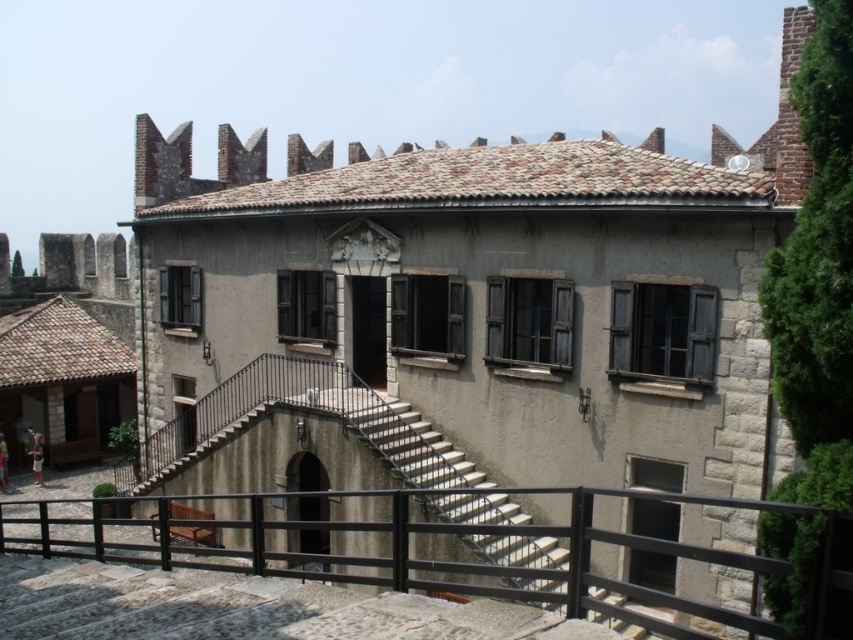
Question: Where is black metal railing at lower center located in relation to white concrete stairs at center in the image?

Choices:
 (A) above
 (B) below

Answer: (B)

Question: Can you confirm if black metal railing at lower center is positioned to the left of white concrete stairs at center?

Choices:
 (A) no
 (B) yes

Answer: (B)

Question: Is black metal railing at lower center bigger than white concrete stairs at center?

Choices:
 (A) yes
 (B) no

Answer: (A)

Question: Which point is closer to the camera?

Choices:
 (A) white concrete stairs at center
 (B) black metal railing at lower center

Answer: (B)

Question: Which point is closer to the camera taking this photo?

Choices:
 (A) (403, 403)
 (B) (408, 564)

Answer: (B)